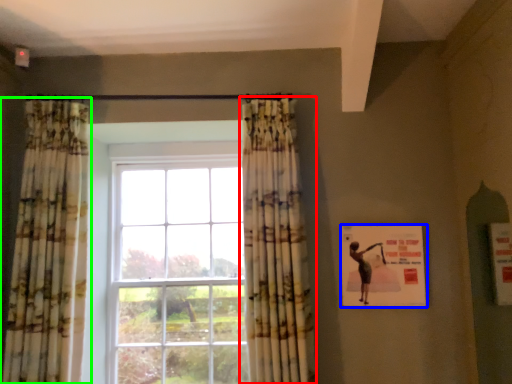
Question: Based on their relative distances, which object is nearer to curtain (highlighted by a red box)? Choose from poster (highlighted by a blue box) and curtain (highlighted by a green box).

Choices:
 (A) poster
 (B) curtain

Answer: (A)